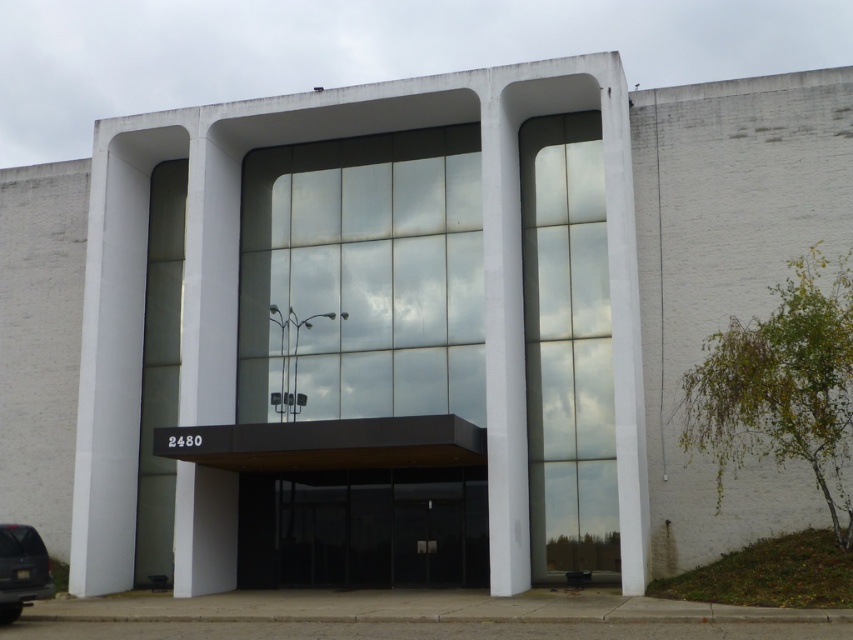
You are standing in front of the building and want to enter through the transparent glass doors at center. There is a shiny black suv at lower left parked nearby. Can you walk directly to the doors without going around the suv?

The transparent glass doors at center are closer to you than the shiny black suv at lower left, so you can walk directly to the doors without needing to go around the suv.

You are a delivery person standing next to the shiny black suv at lower left. You need to deliver a package to the transparent glass doors at center. Can you walk directly to them without crossing any obstacles?

The distance between the transparent glass doors at center and the shiny black suv at lower left is 7.56 meters. Since there are no obstacles mentioned in the scene description, you can walk directly to them.

From the picture: You are a delivery person arriving at the building. You need to enter through the transparent glass doors at center. Can you park your shiny black suv at lower left close to the doors without blocking the entrance?

The transparent glass doors at center are larger in size than the shiny black suv at lower left. Since the doors are larger, the suv can be parked close to them without blocking the entrance as long as it is positioned appropriately.